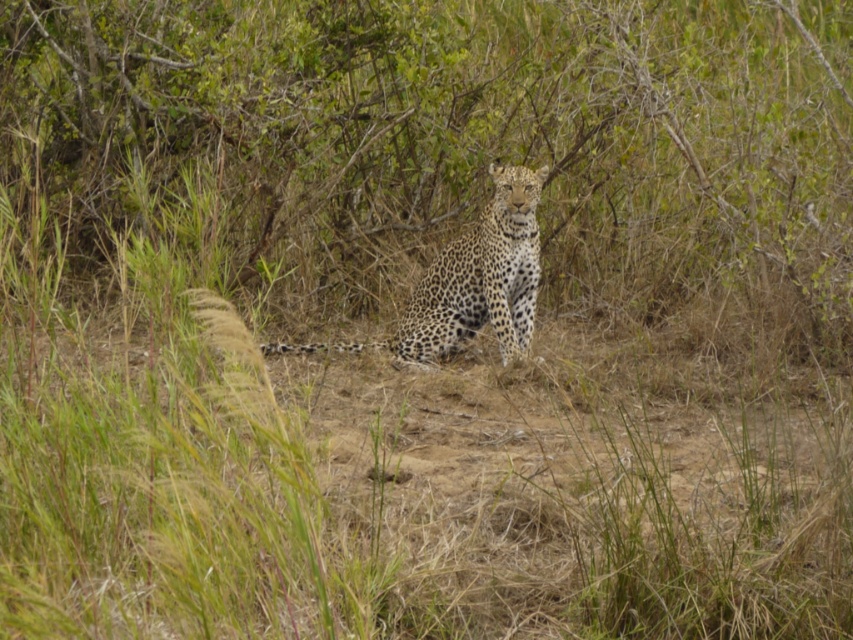
Can you confirm if green leafy bush at center is smaller than spotted fur leopard at center?

Correct, green leafy bush at center occupies less space than spotted fur leopard at center.

Image resolution: width=853 pixels, height=640 pixels. What do you see at coordinates (444, 138) in the screenshot? I see `green leafy bush at center` at bounding box center [444, 138].

Find the location of `green leafy bush at center`. green leafy bush at center is located at coordinates [x=444, y=138].